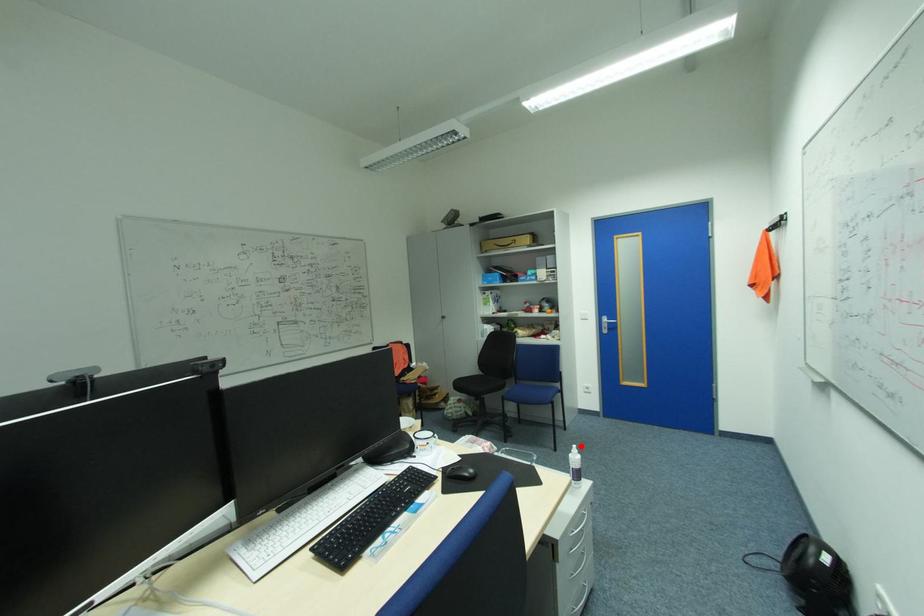
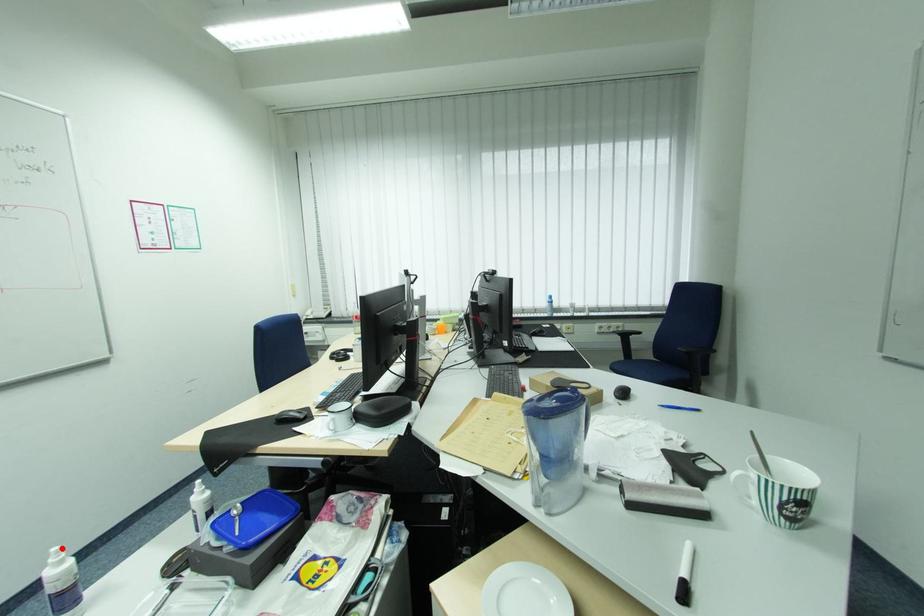
I am providing you with two images of the same scene from different viewpoints. A red point is marked on the first image and another point is marked on the second image. Is the red point in image1 aligned with the point shown in image2?

Yes